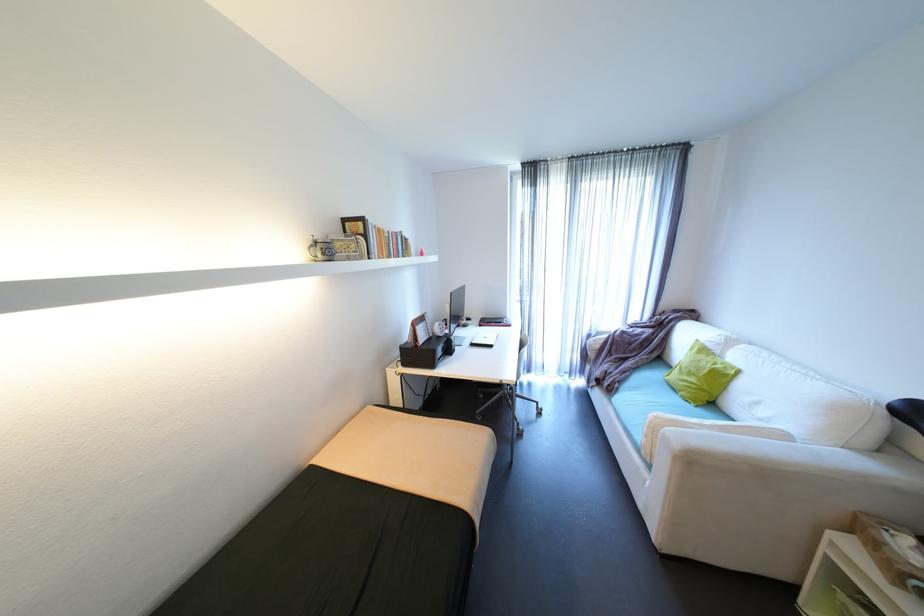
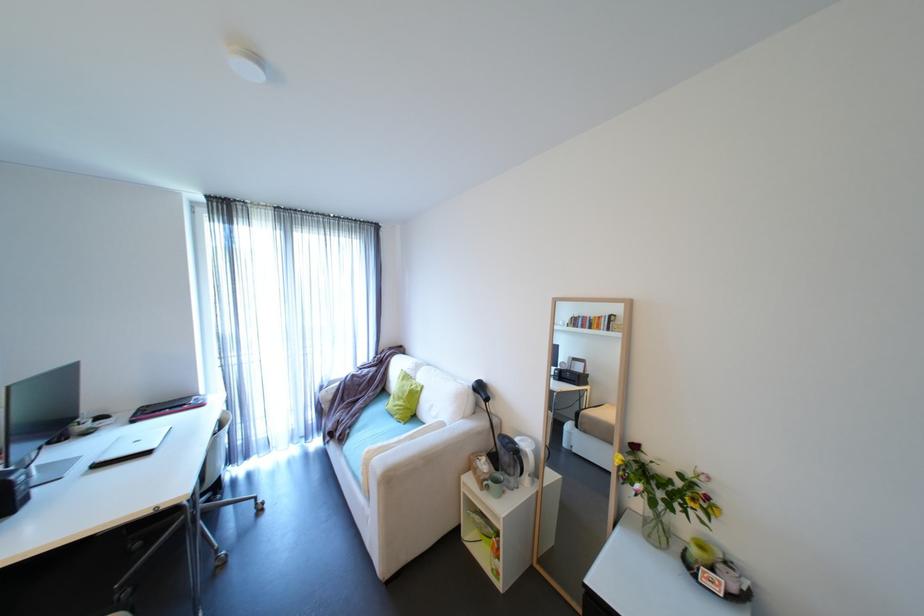
Find the pixel in the second image that matches (x=616, y=389) in the first image.

(347, 438)